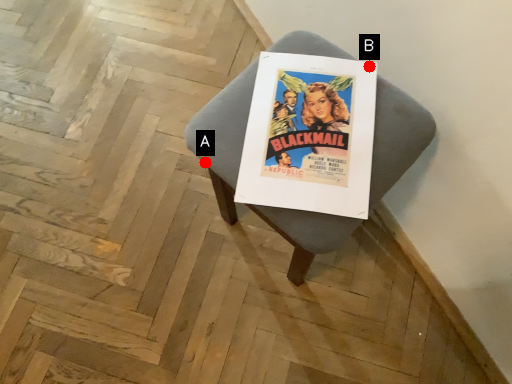
Question: Two points are circled on the image, labeled by A and B beside each circle. Which point is further to the camera?

Choices:
 (A) A is further
 (B) B is further

Answer: (A)